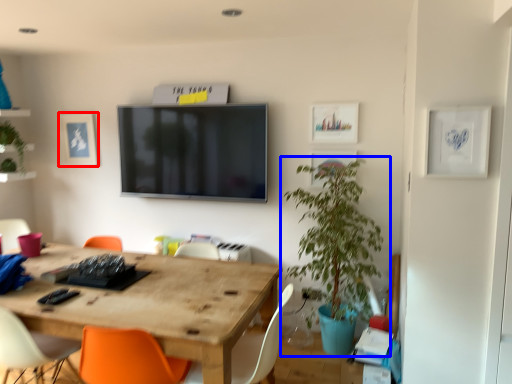
Question: Which object appears farthest to the camera in this image, picture frame (highlighted by a red box) or houseplant (highlighted by a blue box)?

Choices:
 (A) picture frame
 (B) houseplant

Answer: (A)